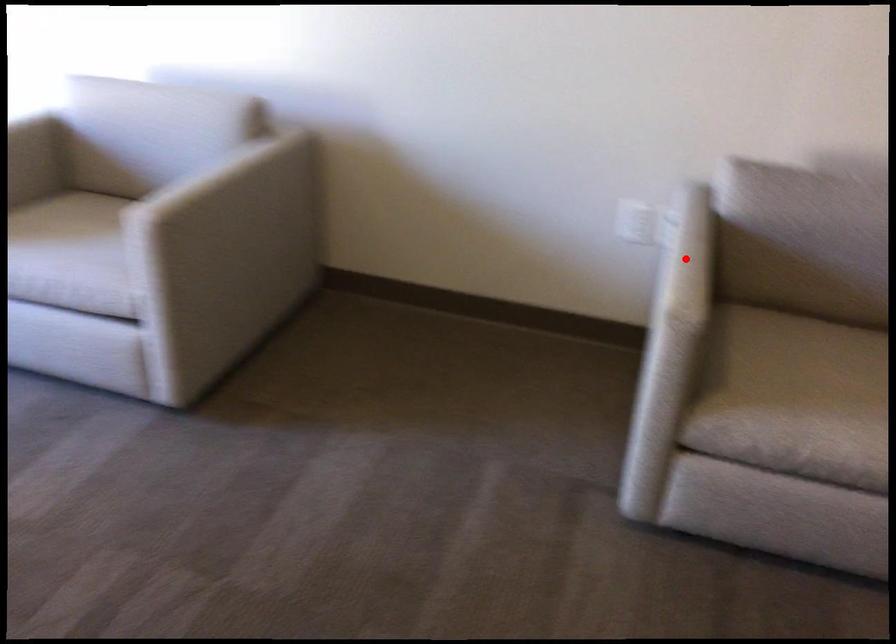
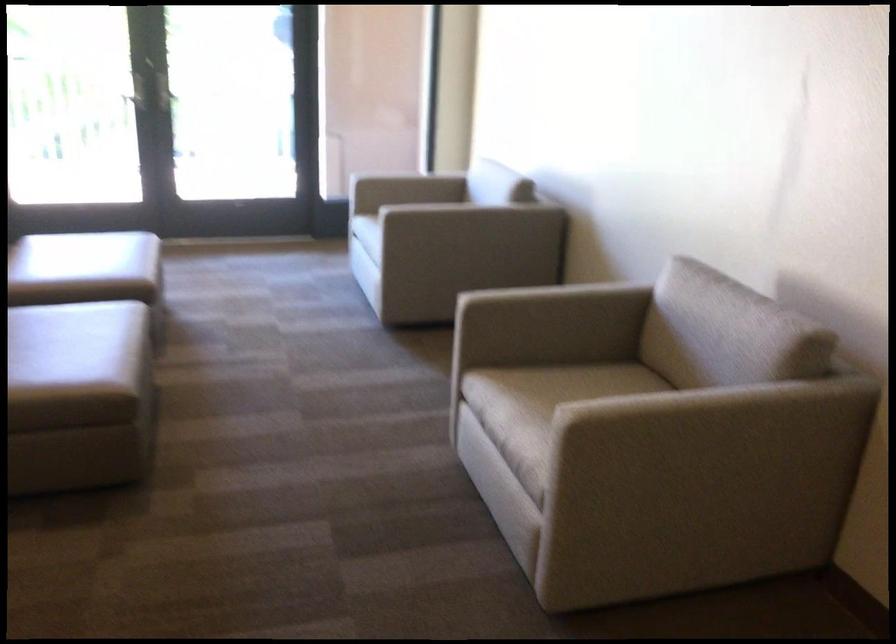
Where in the second image is the point corresponding to the highlighted location from the first image?

(533, 287)